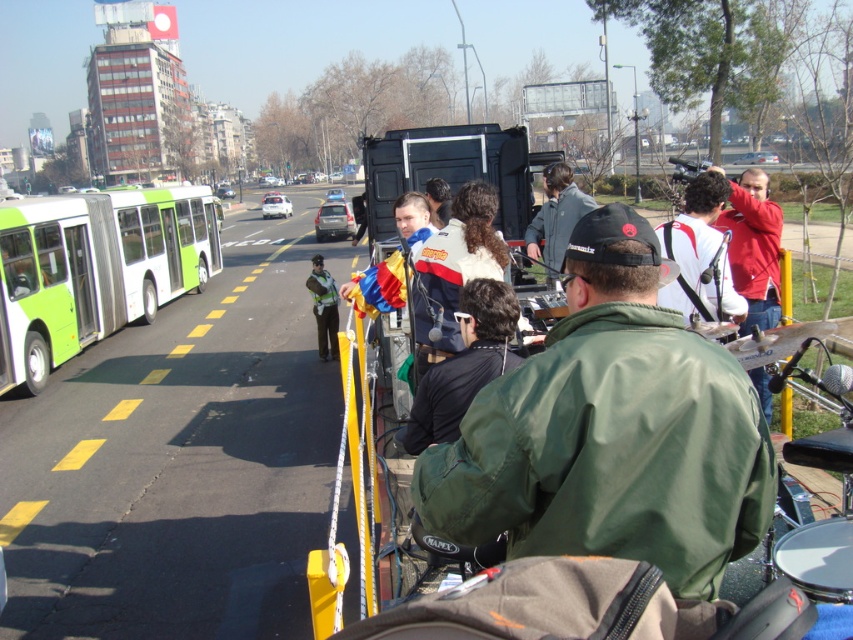
Is green matte bus at left thinner than dark brown leather jacket at upper center?

No.

Looking at this image, between green matte bus at left and dark brown leather jacket at upper center, which one has more height?

Standing taller between the two is green matte bus at left.

Who is more forward, (4, 257) or (433, 186)?

Point (433, 186)

Identify the location of green matte bus at left. (94, 269).

Based on the photo, is green matte jacket at center to the left of white fabric shirt at upper right from the viewer's perspective?

Correct, you'll find green matte jacket at center to the left of white fabric shirt at upper right.

Who is lower down, green matte jacket at center or white fabric shirt at upper right?

green matte jacket at center

Between point (583, 305) and point (718, 234), which one is positioned behind?

The point (718, 234) is behind.

The width and height of the screenshot is (853, 640). In order to click on green matte jacket at center in this screenshot , I will do `click(611, 429)`.

From the picture: Can you confirm if green matte jacket at center is thinner than green matte bus at left?

Indeed, green matte jacket at center has a lesser width compared to green matte bus at left.

Image resolution: width=853 pixels, height=640 pixels. Describe the element at coordinates (611, 429) in the screenshot. I see `green matte jacket at center` at that location.

Image resolution: width=853 pixels, height=640 pixels. I want to click on green matte jacket at center, so click(x=611, y=429).